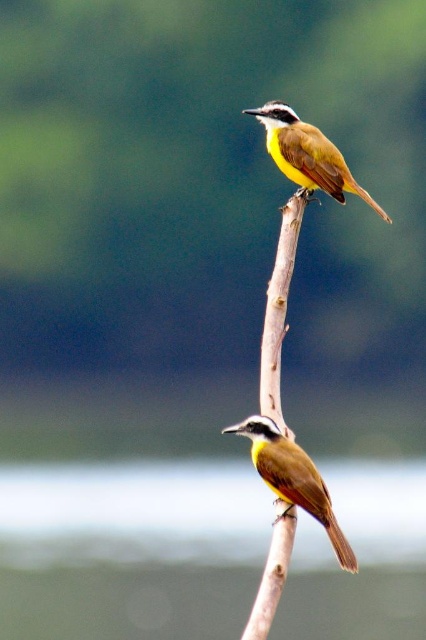
Looking at this image, you are a birdwatcher observing the scene. You notice the brown wood at center and the brown feathered bird at upper center. Which object is positioned higher in the image?

The brown feathered bird at upper center is positioned higher than the brown wood at center.

You are observing two points on a branch where two birds are perched. The points are labeled as point [271,580] and point [317,477]. Based on the scene, which point is closer to you?

Point [271,580] is closer to the viewer than point [317,477].